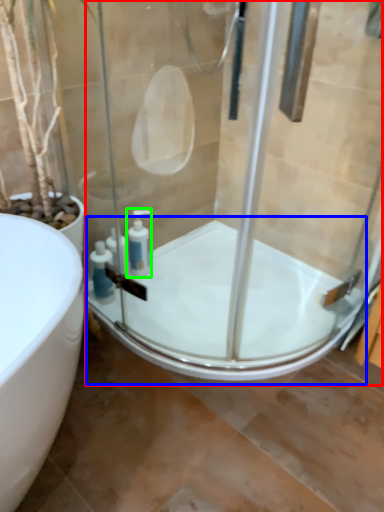
Question: Which is farther away from shower door (highlighted by a red box)? bath (highlighted by a blue box) or soap dispenser (highlighted by a green box)?

Choices:
 (A) bath
 (B) soap dispenser

Answer: (B)